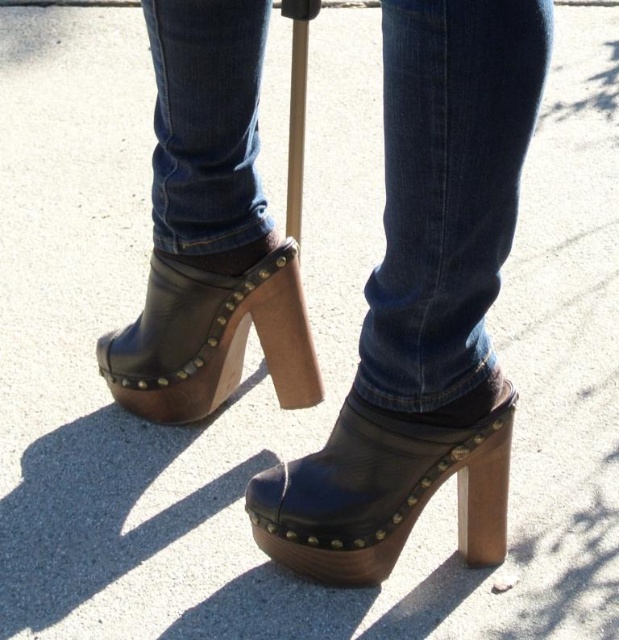
Can you confirm if denim at center is wider than leather studded clog at center?

No, denim at center is not wider than leather studded clog at center.

In the scene shown: Does denim at center appear on the left side of leather studded clog at center?

In fact, denim at center is to the right of leather studded clog at center.

I want to click on denim at center, so click(448, 189).

Is denim at center taller than black leather clog at center?

Yes.

What do you see at coordinates (448, 189) in the screenshot? I see `denim at center` at bounding box center [448, 189].

At what (x,y) coordinates should I click in order to perform the action: click on denim at center. Please return your answer as a coordinate pair (x, y). This screenshot has width=619, height=640. Looking at the image, I should click on (448, 189).

Who is lower down, black leather clog at center or leather studded clog at center?

black leather clog at center is below.

Is point (322, 522) positioned in front of point (236, 280)?

Yes, it is in front of point (236, 280).

Which is behind, point (262, 509) or point (240, 276)?

Positioned behind is point (240, 276).

Find the location of a particular element. The height and width of the screenshot is (640, 619). black leather clog at center is located at coordinates (x=384, y=490).